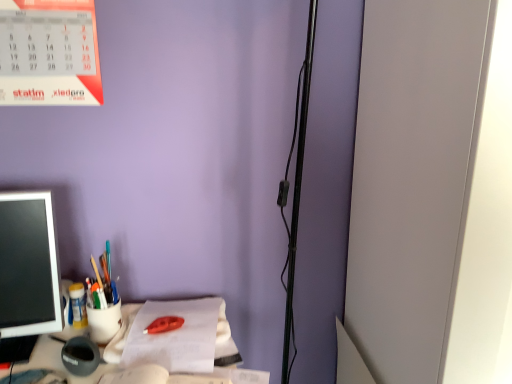
Question: Does matte plastic cup at left, which is the third stationery from back to front, have a lesser height compared to matte plastic pen holder at left?

Choices:
 (A) no
 (B) yes

Answer: (B)

Question: Is matte plastic cup at left, which ranks as the 2th stationery in front-to-back order, not inside matte plastic pen holder at left?

Choices:
 (A) yes
 (B) no

Answer: (A)

Question: Can you confirm if matte plastic cup at left, which ranks as the 2th stationery in front-to-back order, is positioned to the right of matte plastic pen holder at left?

Choices:
 (A) no
 (B) yes

Answer: (B)

Question: Does matte plastic cup at left, which is the third stationery from back to front, lie behind matte plastic pen holder at left?

Choices:
 (A) yes
 (B) no

Answer: (A)

Question: From a real-world perspective, is matte plastic cup at left, which is the third stationery from back to front, under matte plastic pen holder at left?

Choices:
 (A) no
 (B) yes

Answer: (B)

Question: Could you tell me if matte plastic cup at left, which is the third stationery from back to front, is turned towards matte plastic pen holder at left?

Choices:
 (A) yes
 (B) no

Answer: (B)

Question: From the image's perspective, is white paper at center located beneath matte plastic pen holder at left?

Choices:
 (A) no
 (B) yes

Answer: (B)

Question: Is white paper at center shorter than matte plastic pen holder at left?

Choices:
 (A) yes
 (B) no

Answer: (A)

Question: Is white paper at center at the right side of matte plastic pen holder at left?

Choices:
 (A) no
 (B) yes

Answer: (B)

Question: Is white paper at center positioned behind matte plastic pen holder at left?

Choices:
 (A) no
 (B) yes

Answer: (B)

Question: Are white paper at center and matte plastic pen holder at left located far from each other?

Choices:
 (A) yes
 (B) no

Answer: (B)

Question: Is white paper at center positioned before matte plastic pen holder at left?

Choices:
 (A) no
 (B) yes

Answer: (A)

Question: Is white paper at center aimed at matte plastic cup at left, which ranks as the 2th stationery in front-to-back order?

Choices:
 (A) yes
 (B) no

Answer: (B)